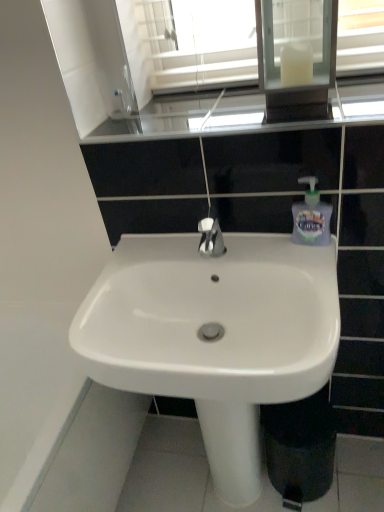
Question: Choose the correct answer: Is glossy glass window sill at upper center inside white glass medicine cabinet at upper center or outside it?

Choices:
 (A) outside
 (B) inside

Answer: (A)

Question: Is glossy glass window sill at upper center bigger or smaller than white glass medicine cabinet at upper center?

Choices:
 (A) big
 (B) small

Answer: (B)

Question: Which object is the farthest from the translucent plastic soap dispenser at right?

Choices:
 (A) white glass medicine cabinet at upper center
 (B) glossy glass window sill at upper center
 (C) white glossy sink at center

Answer: (C)

Question: Which of these objects is positioned closest to the white glass medicine cabinet at upper center?

Choices:
 (A) translucent plastic soap dispenser at right
 (B) glossy glass window sill at upper center
 (C) white glossy sink at center

Answer: (B)